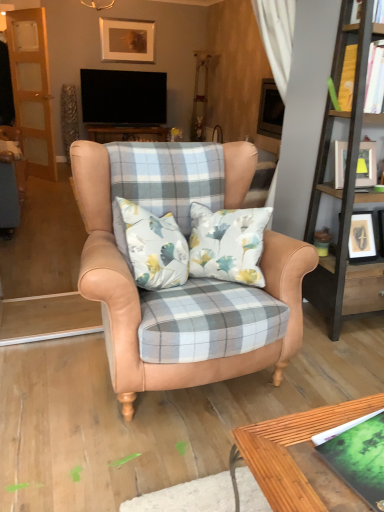
Question: Is green matte book at lower right, the 1th book in the bottom-to-top sequence, taller or shorter than matte white picture frame at upper right, the 1th picture frame positioned from the bottom?

Choices:
 (A) short
 (B) tall

Answer: (A)

Question: From the image's perspective, is green matte book at lower right, the 2th book in the right-to-left sequence, positioned above or below matte white picture frame at upper right, arranged as the second picture frame when viewed from the top?

Choices:
 (A) below
 (B) above

Answer: (A)

Question: Which is nearer to the matte gold picture frame at upper center, which is counted as the 1th picture frame, starting from the top?

Choices:
 (A) leather wingback chair at center
 (B) wooden bookshelf at right
 (C) green matte book at lower right, arranged as the first book when viewed from the left
 (D) yellow paper book at upper right, the 2th book positioned from the front
 (E) wooden screen door at left

Answer: (E)

Question: Based on their relative distances, which object is farther from the green matte book at lower right, which appears as the second book when viewed from the back?

Choices:
 (A) wooden bookshelf at right
 (B) matte white picture frame at upper right, arranged as the second picture frame when viewed from the top
 (C) wooden screen door at left
 (D) leather wingback chair at center
 (E) yellow paper book at upper right, which is counted as the second book, starting from the bottom

Answer: (C)